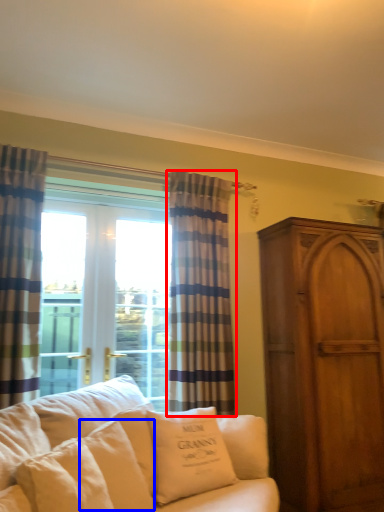
Question: Which point is further to the camera, curtain (highlighted by a red box) or pillow (highlighted by a blue box)?

Choices:
 (A) curtain
 (B) pillow

Answer: (A)